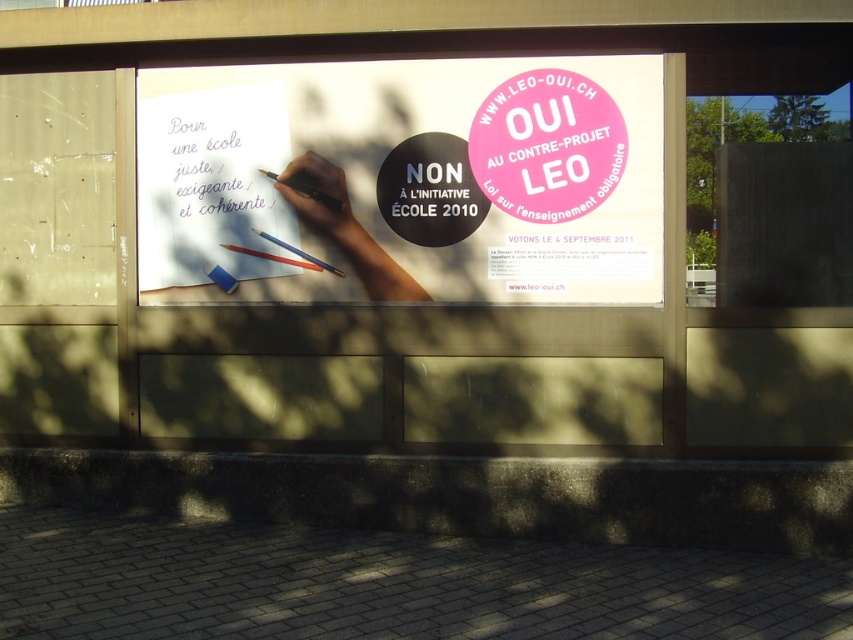
You are an artist trying to sketch the scene from memory. You recall seeing a smooth skin hand at center and a black plastic pen at upper left. Which object should you draw first if you want to follow the size from biggest to smallest?

The smooth skin hand at center should be drawn first because it is larger in size than the black plastic pen at upper left.

You are an artist trying to replicate the exact position of the black plastic pen at upper left in the image. What are the coordinates where you should place it?

The black plastic pen at upper left should be placed at coordinates (305, 189).